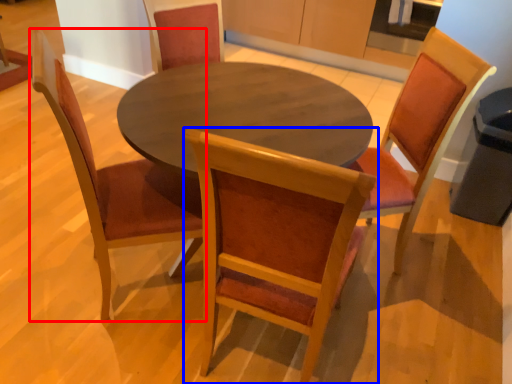
Question: Which object is further to the camera taking this photo, chair (highlighted by a red box) or chair (highlighted by a blue box)?

Choices:
 (A) chair
 (B) chair

Answer: (A)